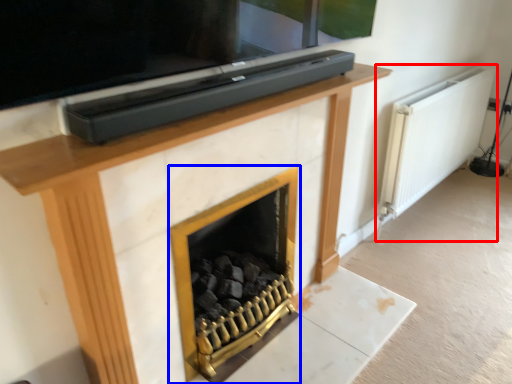
Question: Which point is closer to the camera, radiator (highlighted by a red box) or fireplace (highlighted by a blue box)?

Choices:
 (A) radiator
 (B) fireplace

Answer: (B)